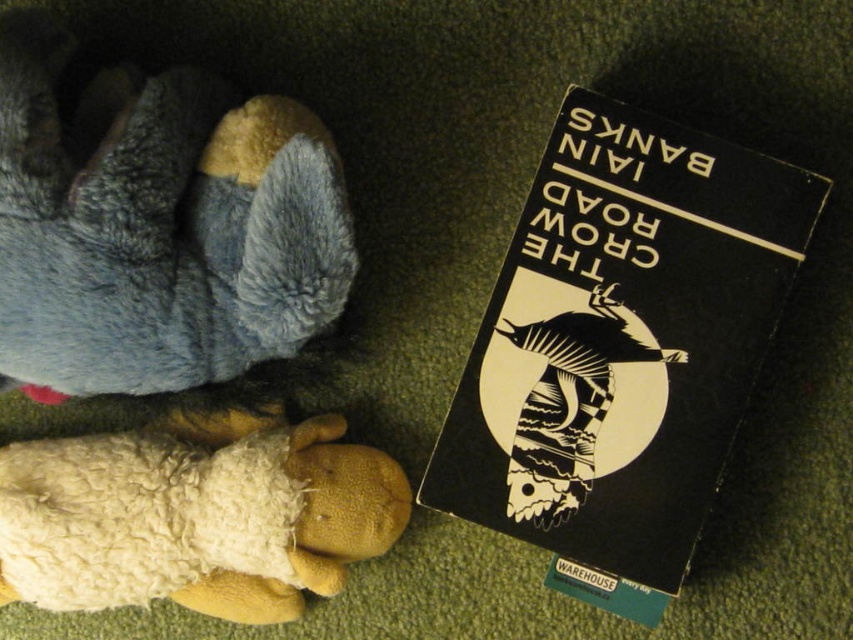
In the scene shown: Is black matte paper at upper right shorter than gray plush toy at upper left?

Incorrect, black matte paper at upper right's height does not fall short of gray plush toy at upper left's.

Looking at this image, measure the distance between black matte paper at upper right and gray plush toy at upper left.

black matte paper at upper right and gray plush toy at upper left are 40.15 centimeters apart.

At what (x,y) coordinates should I click in order to perform the action: click on black matte paper at upper right. Please return your answer as a coordinate pair (x, y). Looking at the image, I should click on (622, 342).

Is gray plush toy at upper left positioned in front of white woolen sheep at lower left?

Yes, it is in front of white woolen sheep at lower left.

Does gray plush toy at upper left have a greater height compared to white woolen sheep at lower left?

Correct, gray plush toy at upper left is much taller as white woolen sheep at lower left.

Measure the distance between point [32,106] and camera.

A distance of 3.58 feet exists between point [32,106] and camera.

Identify the location of gray plush toy at upper left. This screenshot has height=640, width=853. tap(157, 225).

How distant is black matte paper at upper right from white woolen sheep at lower left?

12.74 inches

Can you confirm if black matte paper at upper right is positioned to the left of white woolen sheep at lower left?

Incorrect, black matte paper at upper right is not on the left side of white woolen sheep at lower left.

Which is in front, point (642, 115) or point (186, 536)?

Positioned in front is point (642, 115).

The width and height of the screenshot is (853, 640). In order to click on black matte paper at upper right in this screenshot , I will do `click(622, 342)`.